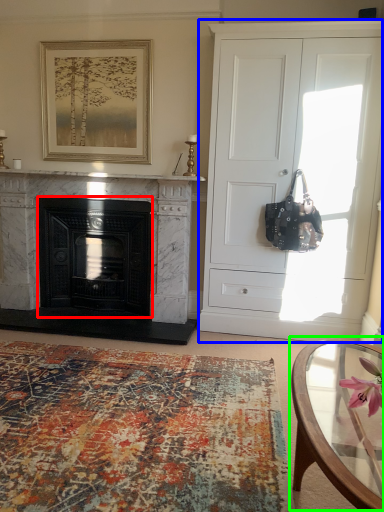
Question: Estimate the real-world distances between objects in this image. Which object is closer to fireplace (highlighted by a red box), cabinetry (highlighted by a blue box) or coffee table (highlighted by a green box)?

Choices:
 (A) cabinetry
 (B) coffee table

Answer: (A)